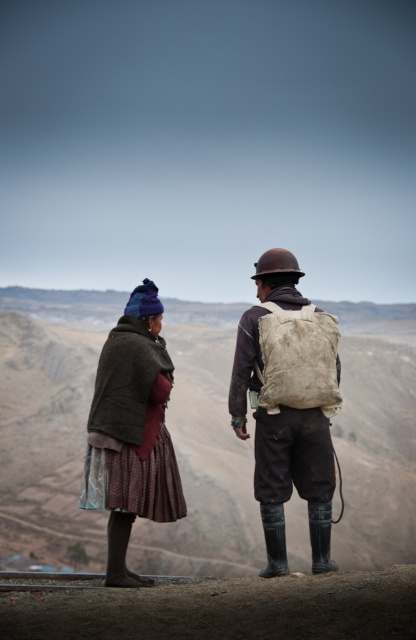
Question: Which point is closer to the camera?

Choices:
 (A) (280, 257)
 (B) (96, 460)

Answer: (B)

Question: Does brown woolen coat at center have a lesser width compared to matte brown backpack at center?

Choices:
 (A) no
 (B) yes

Answer: (B)

Question: Estimate the real-world distances between objects in this image. Which object is farther from the dark brown woolen coat at left?

Choices:
 (A) matte brown backpack at center
 (B) brown woolen coat at center

Answer: (A)

Question: Can you confirm if brown woolen coat at center is positioned to the right of dark brown woolen coat at left?

Choices:
 (A) no
 (B) yes

Answer: (B)

Question: Does brown woolen coat at center appear over matte brown backpack at center?

Choices:
 (A) no
 (B) yes

Answer: (B)

Question: Which object appears farthest from the camera in this image?

Choices:
 (A) dark brown woolen coat at left
 (B) matte brown backpack at center
 (C) brown woolen coat at center

Answer: (A)